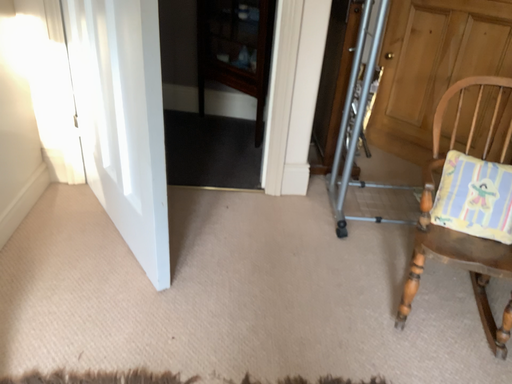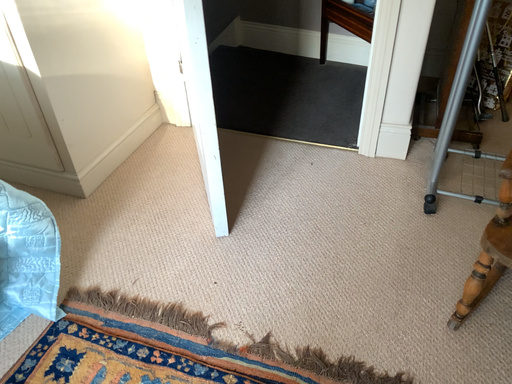
Question: Which way did the camera rotate in the video?

Choices:
 (A) rotated downward
 (B) rotated upward

Answer: (A)